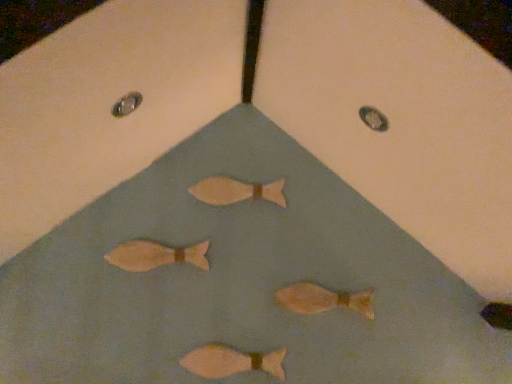
This screenshot has width=512, height=384. What do you see at coordinates (322, 299) in the screenshot? I see `matte orange fish at center, which appears as the 3th fish when viewed from the top` at bounding box center [322, 299].

How much space does matte pink fish at center, marked as the fourth fish in a top-to-bottom arrangement, occupy vertically?

The height of matte pink fish at center, marked as the fourth fish in a top-to-bottom arrangement, is 4.96 inches.

Identify the location of matte orange fish at center, which appears as the 3th fish when viewed from the top. Image resolution: width=512 pixels, height=384 pixels. (322, 299).

Is the depth of matte wooden fish at center, positioned as the first fish in top-to-bottom order, greater than that of matte brown fish at center, the 2th fish viewed from the top?

Yes.

Could you tell me if matte wooden fish at center, positioned as the fourth fish in bottom-to-top order, is turned towards matte brown fish at center, the third fish positioned from the bottom?

No, matte wooden fish at center, positioned as the fourth fish in bottom-to-top order, does not turn towards matte brown fish at center, the third fish positioned from the bottom.

Is matte wooden fish at center, positioned as the first fish in top-to-bottom order, touching matte brown fish at center, the third fish positioned from the bottom?

matte wooden fish at center, positioned as the first fish in top-to-bottom order, and matte brown fish at center, the third fish positioned from the bottom, are clearly separated.

The image size is (512, 384). I want to click on the 2nd fish to the left when counting from the matte wooden fish at center, positioned as the fourth fish in bottom-to-top order, so pyautogui.click(x=155, y=255).

From the image's perspective, which one is positioned higher, matte pink fish at center, the first fish ordered from the bottom, or matte brown fish at center, the 2th fish viewed from the top?

From the image's view, matte brown fish at center, the 2th fish viewed from the top, is above.

Consider the image. Does matte pink fish at center, the first fish ordered from the bottom, have a greater height compared to matte brown fish at center, the 2th fish viewed from the top?

In fact, matte pink fish at center, the first fish ordered from the bottom, may be shorter than matte brown fish at center, the 2th fish viewed from the top.

Is matte pink fish at center, marked as the fourth fish in a top-to-bottom arrangement, far away from matte brown fish at center, the 2th fish viewed from the top?

No, matte pink fish at center, marked as the fourth fish in a top-to-bottom arrangement, is not far away from matte brown fish at center, the 2th fish viewed from the top.

Considering the sizes of objects matte pink fish at center, the first fish ordered from the bottom, and matte brown fish at center, the third fish positioned from the bottom, in the image provided, who is bigger, matte pink fish at center, the first fish ordered from the bottom, or matte brown fish at center, the third fish positioned from the bottom,?

With larger size is matte brown fish at center, the third fish positioned from the bottom.

Considering the relative sizes of matte orange fish at center, the second fish ordered from the bottom, and matte wooden fish at center, positioned as the first fish in top-to-bottom order, in the image provided, is matte orange fish at center, the second fish ordered from the bottom, shorter than matte wooden fish at center, positioned as the first fish in top-to-bottom order,?

No, matte orange fish at center, the second fish ordered from the bottom, is not shorter than matte wooden fish at center, positioned as the first fish in top-to-bottom order.

Between matte orange fish at center, the second fish ordered from the bottom, and matte wooden fish at center, positioned as the fourth fish in bottom-to-top order, which one appears on the left side from the viewer's perspective?

From the viewer's perspective, matte wooden fish at center, positioned as the fourth fish in bottom-to-top order, appears more on the left side.

Is matte brown fish at center, the 2th fish viewed from the top, oriented towards matte orange fish at center, which appears as the 3th fish when viewed from the top?

No, matte brown fish at center, the 2th fish viewed from the top, is not oriented towards matte orange fish at center, which appears as the 3th fish when viewed from the top.

Which point is more forward, (137, 252) or (296, 286)?

The point (137, 252) is more forward.

Between matte brown fish at center, the 2th fish viewed from the top, and matte orange fish at center, which appears as the 3th fish when viewed from the top, which one has larger width?

Wider between the two is matte brown fish at center, the 2th fish viewed from the top.

Which point is more distant from viewer, (246, 191) or (234, 361)?

The point (246, 191) is behind.

Is matte wooden fish at center, positioned as the fourth fish in bottom-to-top order, turned away from matte pink fish at center, the first fish ordered from the bottom?

matte wooden fish at center, positioned as the fourth fish in bottom-to-top order, is not turned away from matte pink fish at center, the first fish ordered from the bottom.

Is matte wooden fish at center, positioned as the fourth fish in bottom-to-top order, next to matte pink fish at center, marked as the fourth fish in a top-to-bottom arrangement, and touching it?

No.

Which of these two, matte wooden fish at center, positioned as the first fish in top-to-bottom order, or matte pink fish at center, the first fish ordered from the bottom, is wider?

matte pink fish at center, the first fish ordered from the bottom.

From a real-world perspective, which is physically above, matte brown fish at center, the third fish positioned from the bottom, or matte pink fish at center, marked as the fourth fish in a top-to-bottom arrangement?

In real-world perspective, matte brown fish at center, the third fish positioned from the bottom, is above.

Is matte brown fish at center, the 2th fish viewed from the top, surrounding matte pink fish at center, the first fish ordered from the bottom?

No, matte pink fish at center, the first fish ordered from the bottom, is not inside matte brown fish at center, the 2th fish viewed from the top.

Would you say matte brown fish at center, the 2th fish viewed from the top, is a long distance from matte pink fish at center, marked as the fourth fish in a top-to-bottom arrangement?

matte brown fish at center, the 2th fish viewed from the top, is near matte pink fish at center, marked as the fourth fish in a top-to-bottom arrangement, not far away.

Can you confirm if matte brown fish at center, the 2th fish viewed from the top, is bigger than matte wooden fish at center, positioned as the fourth fish in bottom-to-top order?

Yes, matte brown fish at center, the 2th fish viewed from the top, is bigger than matte wooden fish at center, positioned as the fourth fish in bottom-to-top order.

Is matte brown fish at center, the third fish positioned from the bottom, facing away from matte wooden fish at center, positioned as the first fish in top-to-bottom order?

matte brown fish at center, the third fish positioned from the bottom, does not have its back to matte wooden fish at center, positioned as the first fish in top-to-bottom order.

Who is shorter, matte brown fish at center, the third fish positioned from the bottom, or matte wooden fish at center, positioned as the first fish in top-to-bottom order?

matte wooden fish at center, positioned as the first fish in top-to-bottom order, is shorter.

Do you think matte brown fish at center, the 2th fish viewed from the top, is within matte wooden fish at center, positioned as the first fish in top-to-bottom order, or outside of it?

The correct answer is: outside.

Where is `the 1st fish located beneath the matte wooden fish at center, positioned as the fourth fish in bottom-to-top order (from a real-world perspective)`? The height and width of the screenshot is (384, 512). the 1st fish located beneath the matte wooden fish at center, positioned as the fourth fish in bottom-to-top order (from a real-world perspective) is located at coordinates (155, 255).

Where is `fish in front of the matte brown fish at center, the 2th fish viewed from the top`? fish in front of the matte brown fish at center, the 2th fish viewed from the top is located at coordinates (231, 362).

Considering their positions, is matte orange fish at center, which appears as the 3th fish when viewed from the top, positioned further to matte wooden fish at center, positioned as the fourth fish in bottom-to-top order, than matte brown fish at center, the third fish positioned from the bottom?

matte orange fish at center, which appears as the 3th fish when viewed from the top.

Estimate the real-world distances between objects in this image. Which object is closer to matte pink fish at center, marked as the fourth fish in a top-to-bottom arrangement, matte orange fish at center, which appears as the 3th fish when viewed from the top, or matte brown fish at center, the 2th fish viewed from the top?

matte orange fish at center, which appears as the 3th fish when viewed from the top, is positioned closer to the anchor matte pink fish at center, marked as the fourth fish in a top-to-bottom arrangement.

Considering their positions, is matte wooden fish at center, positioned as the first fish in top-to-bottom order, positioned closer to matte pink fish at center, the first fish ordered from the bottom, than matte brown fish at center, the third fish positioned from the bottom?

matte brown fish at center, the third fish positioned from the bottom.

Based on their spatial positions, is matte wooden fish at center, positioned as the first fish in top-to-bottom order, or matte orange fish at center, which appears as the 3th fish when viewed from the top, further from matte pink fish at center, marked as the fourth fish in a top-to-bottom arrangement?

matte wooden fish at center, positioned as the first fish in top-to-bottom order, lies further to matte pink fish at center, marked as the fourth fish in a top-to-bottom arrangement, than the other object.

Looking at the image, which one is located closer to matte brown fish at center, the third fish positioned from the bottom, matte wooden fish at center, positioned as the first fish in top-to-bottom order, or matte orange fish at center, the second fish ordered from the bottom?

matte wooden fish at center, positioned as the first fish in top-to-bottom order, is closer to matte brown fish at center, the third fish positioned from the bottom.

From the image, which object appears to be farther from matte wooden fish at center, positioned as the fourth fish in bottom-to-top order, matte pink fish at center, marked as the fourth fish in a top-to-bottom arrangement, or matte orange fish at center, which appears as the 3th fish when viewed from the top?

Based on the image, matte pink fish at center, marked as the fourth fish in a top-to-bottom arrangement, appears to be further to matte wooden fish at center, positioned as the fourth fish in bottom-to-top order.

Considering their positions, is matte pink fish at center, the first fish ordered from the bottom, positioned closer to matte wooden fish at center, positioned as the fourth fish in bottom-to-top order, than matte brown fish at center, the 2th fish viewed from the top?

matte brown fish at center, the 2th fish viewed from the top, is closer to matte wooden fish at center, positioned as the fourth fish in bottom-to-top order.

Which object lies further to the anchor point matte pink fish at center, the first fish ordered from the bottom, matte brown fish at center, the 2th fish viewed from the top, or matte orange fish at center, which appears as the 3th fish when viewed from the top?

matte brown fish at center, the 2th fish viewed from the top, lies further to matte pink fish at center, the first fish ordered from the bottom, than the other object.